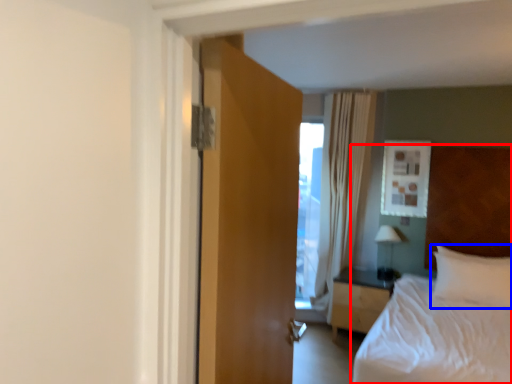
Question: Which point is further to the camera, bed (highlighted by a red box) or pillow (highlighted by a blue box)?

Choices:
 (A) bed
 (B) pillow

Answer: (B)